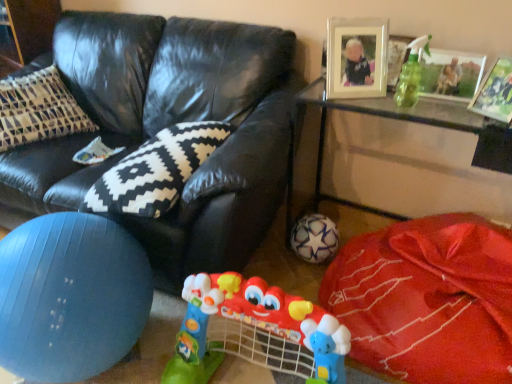
The image size is (512, 384). Describe the element at coordinates (156, 170) in the screenshot. I see `black and white zigzag pillow at center` at that location.

Locate an element on the screen. This screenshot has width=512, height=384. metallic silver picture frame at upper right, which appears as the second picture frame when viewed from the right is located at coordinates (450, 74).

Identify the location of blue rubber ball at lower left. (70, 297).

Describe the element at coordinates (397, 119) in the screenshot. I see `transparent glass table at lower right` at that location.

Where is `black and white zigzag pillow at center`? black and white zigzag pillow at center is located at coordinates (156, 170).

From a real-world perspective, is blue rubber ball at lower left positioned under white textured ball at lower center based on gravity?

Actually, blue rubber ball at lower left is physically above white textured ball at lower center in the real world.

This screenshot has width=512, height=384. What are the coordinates of `ball in front of the white textured ball at lower center` in the screenshot? It's located at (70, 297).

From the image's perspective, which is above, blue rubber ball at lower left or white textured ball at lower center?

white textured ball at lower center is shown above in the image.

Would you say blue rubber ball at lower left is outside white textured ball at lower center?

blue rubber ball at lower left is positioned outside white textured ball at lower center.

Where is `material to the right of wooden picture frame at upper right, which appears as the first picture frame when viewed from the left`? material to the right of wooden picture frame at upper right, which appears as the first picture frame when viewed from the left is located at coordinates coord(428,299).

From the image's perspective, which is below, white textured ball at lower center or wooden picture frame at upper right, which appears as the first picture frame when viewed from the left?

white textured ball at lower center is shown below in the image.

Between white textured ball at lower center and wooden picture frame at upper right, acting as the 3th picture frame starting from the right, which one has smaller size?

wooden picture frame at upper right, acting as the 3th picture frame starting from the right, is smaller.

How different are the orientations of white textured ball at lower center and wooden picture frame at upper right, acting as the 3th picture frame starting from the right, in degrees?

The angular difference between white textured ball at lower center and wooden picture frame at upper right, acting as the 3th picture frame starting from the right, is 34 degrees.

From a real-world perspective, is plastic colorful baby walker at center physically located above or below wooden picture frame at upper right, which appears as the first picture frame when viewed from the left?

In terms of real-world spatial position, plastic colorful baby walker at center is below wooden picture frame at upper right, which appears as the first picture frame when viewed from the left.

Which of these two, plastic colorful baby walker at center or wooden picture frame at upper right, acting as the 3th picture frame starting from the right, stands shorter?

Standing shorter between the two is wooden picture frame at upper right, acting as the 3th picture frame starting from the right.

Is plastic colorful baby walker at center outside of wooden picture frame at upper right, acting as the 3th picture frame starting from the right?

Yes, plastic colorful baby walker at center is outside of wooden picture frame at upper right, acting as the 3th picture frame starting from the right.

Is plastic colorful baby walker at center positioned with its back to wooden picture frame at upper right, acting as the 3th picture frame starting from the right?

No, plastic colorful baby walker at center is not facing the opposite direction of wooden picture frame at upper right, acting as the 3th picture frame starting from the right.

Can you confirm if black and white zigzag pillow at center is positioned to the right of plastic colorful baby walker at center?

In fact, black and white zigzag pillow at center is to the left of plastic colorful baby walker at center.

Between black and white zigzag pillow at center and plastic colorful baby walker at center, which one has larger size?

Bigger between the two is plastic colorful baby walker at center.

Is black and white zigzag pillow at center next to plastic colorful baby walker at center and touching it?

No, black and white zigzag pillow at center is not next to plastic colorful baby walker at center.

From the picture: Who is more distant, black and white zigzag pillow at center or plastic colorful baby walker at center?

black and white zigzag pillow at center is further away from the camera.

Is white star-patterned ball at lower center thinner than transparent glass table at lower right?

Indeed, white star-patterned ball at lower center has a lesser width compared to transparent glass table at lower right.

What's the angular difference between white star-patterned ball at lower center and transparent glass table at lower right's facing directions?

The angle between the facing direction of white star-patterned ball at lower center and the facing direction of transparent glass table at lower right is 4.46 degrees.

From the image's perspective, does white star-patterned ball at lower center appear lower than transparent glass table at lower right?

Correct, white star-patterned ball at lower center appears lower than transparent glass table at lower right in the image.

Is white star-patterned ball at lower center next to transparent glass table at lower right and touching it?

No, white star-patterned ball at lower center is not next to transparent glass table at lower right.

Can you tell me how much transparent glass table at lower right and white textured ball at lower center differ in facing direction?

transparent glass table at lower right and white textured ball at lower center are facing 2.43 degrees away from each other.

In terms of height, does transparent glass table at lower right look taller or shorter compared to white textured ball at lower center?

In the image, transparent glass table at lower right appears to be taller than white textured ball at lower center.

Identify the location of table above the white textured ball at lower center (from the image's perspective). (397, 119).

Is transparent glass table at lower right not inside white textured ball at lower center?

No, transparent glass table at lower right is not entirely external to white textured ball at lower center.

From the picture: Is metallic silver picture frame at upper right, the first picture frame positioned from the right, beside transparent glass table at lower right?

They are not placed beside each other.

Measure the distance from metallic silver picture frame at upper right, the first picture frame positioned from the right, to transparent glass table at lower right.

metallic silver picture frame at upper right, the first picture frame positioned from the right, is 15.33 inches from transparent glass table at lower right.

From the image's perspective, which one is positioned lower, metallic silver picture frame at upper right, the first picture frame positioned from the right, or transparent glass table at lower right?

transparent glass table at lower right.

Is metallic silver picture frame at upper right, the first picture frame positioned from the right, outside of transparent glass table at lower right?

Absolutely, metallic silver picture frame at upper right, the first picture frame positioned from the right, is external to transparent glass table at lower right.

Locate an element on the screen. Image resolution: width=512 pixels, height=384 pixels. ball on the left of white textured ball at lower center is located at coordinates (70, 297).

Identify the location of material lying on the right of wooden picture frame at upper right, which appears as the first picture frame when viewed from the left. (428, 299).

Based on their spatial positions, is black and white zigzag pillow at center or blue rubber ball at lower left further from white star-patterned ball at lower center?

blue rubber ball at lower left is positioned further to the anchor white star-patterned ball at lower center.

Based on their spatial positions, is transparent glass table at lower right or black leather couch at center further from plastic colorful baby walker at center?

transparent glass table at lower right is positioned further to the anchor plastic colorful baby walker at center.

Looking at the image, which one is located further to transparent glass table at lower right, metallic silver picture frame at upper right, the second picture frame viewed from the left, or wooden picture frame at upper right, acting as the 3th picture frame starting from the right?

The object further to transparent glass table at lower right is wooden picture frame at upper right, acting as the 3th picture frame starting from the right.

Estimate the real-world distances between objects in this image. Which object is further from metallic silver picture frame at upper right, positioned as the 3th picture frame in left-to-right order, black and white zigzag pillow at center or plastic colorful baby walker at center?

black and white zigzag pillow at center.

When comparing their distances from black and white zigzag pillow at center, does transparent glass table at lower right or metallic silver picture frame at upper right, the second picture frame viewed from the left, seem further?

metallic silver picture frame at upper right, the second picture frame viewed from the left, lies further to black and white zigzag pillow at center than the other object.

Estimate the real-world distances between objects in this image. Which object is further from wooden picture frame at upper right, acting as the 3th picture frame starting from the right, metallic silver picture frame at upper right, positioned as the 3th picture frame in left-to-right order, or white star-patterned ball at lower center?

Based on the image, white star-patterned ball at lower center appears to be further to wooden picture frame at upper right, acting as the 3th picture frame starting from the right.

Looking at the image, which one is located further to metallic silver picture frame at upper right, the second picture frame viewed from the left, white textured ball at lower center or wooden picture frame at upper right, acting as the 3th picture frame starting from the right?

white textured ball at lower center lies further to metallic silver picture frame at upper right, the second picture frame viewed from the left, than the other object.

Estimate the real-world distances between objects in this image. Which object is closer to metallic silver picture frame at upper right, positioned as the 3th picture frame in left-to-right order, blue rubber ball at lower left or white textured ball at lower center?

The object closer to metallic silver picture frame at upper right, positioned as the 3th picture frame in left-to-right order, is white textured ball at lower center.

Where is `pillow located between blue rubber ball at lower left and transparent glass table at lower right in the left-right direction`? pillow located between blue rubber ball at lower left and transparent glass table at lower right in the left-right direction is located at coordinates (156, 170).

In order to click on picture frame located between black leather couch at center and transparent glass table at lower right in the left-right direction in this screenshot , I will do `click(357, 58)`.

The height and width of the screenshot is (384, 512). In order to click on material between wooden picture frame at upper right, acting as the 3th picture frame starting from the right, and plastic colorful baby walker at center in the up-down direction in this screenshot , I will do `click(428, 299)`.

The height and width of the screenshot is (384, 512). Find the location of `toy between black leather couch at center and metallic silver picture frame at upper right, which appears as the second picture frame when viewed from the right, from left to right`. toy between black leather couch at center and metallic silver picture frame at upper right, which appears as the second picture frame when viewed from the right, from left to right is located at coordinates (255, 331).